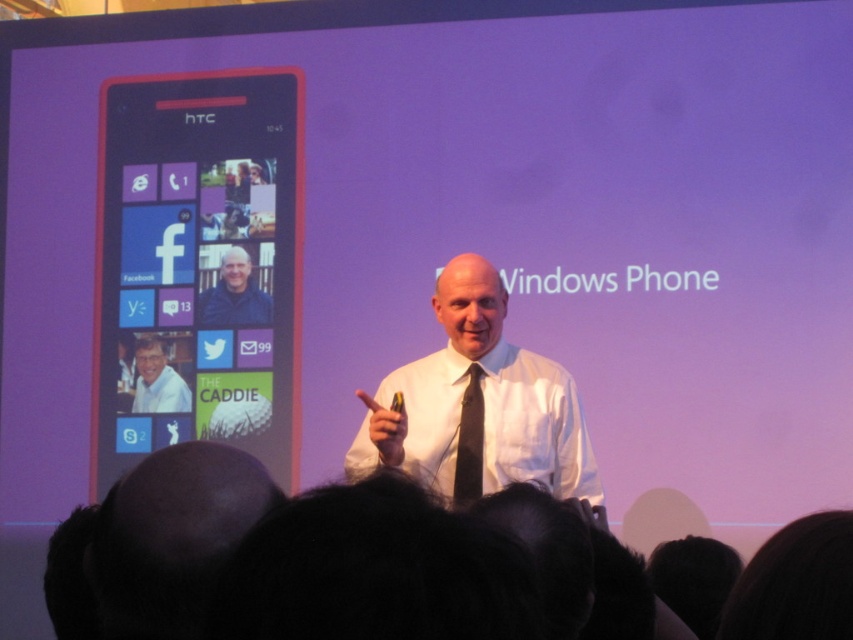
You are an event photographer at the back of the room. You want to take a photo of the man on stage focusing on his clothing. Which clothing item will appear bigger in the photo, the white shirt at center or the silky black tie at center?

The white shirt at center will appear bigger in the photo because it is larger in size than the silky black tie at center.

You are an attendee at the presentation and want to take a photo of the HTC smartphone displayed on the left side of the screen. The HTC smartphone is shown at the point labeled point (195, 125). If your camera has a maximum focus range of 20 feet, will you be able to clearly capture the HTC smartphone in your photo?

The point (195, 125) where the HTC smartphone is displayed is 20.95 feet away from the viewer. Since the camera can only focus up to 20 feet, the distance is beyond the camera s maximum focus range. Therefore, the HTC smartphone will not be clearly captured.